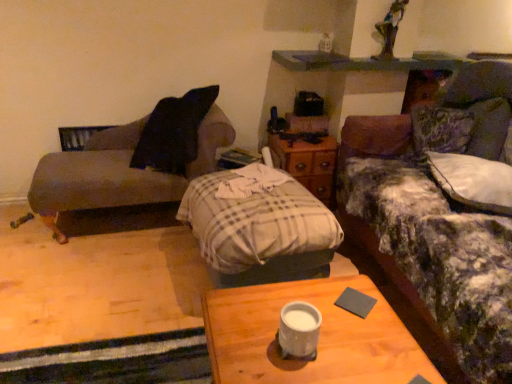
Where is `free space to the left of gray matte pad at center`? Image resolution: width=512 pixels, height=384 pixels. free space to the left of gray matte pad at center is located at coordinates (310, 299).